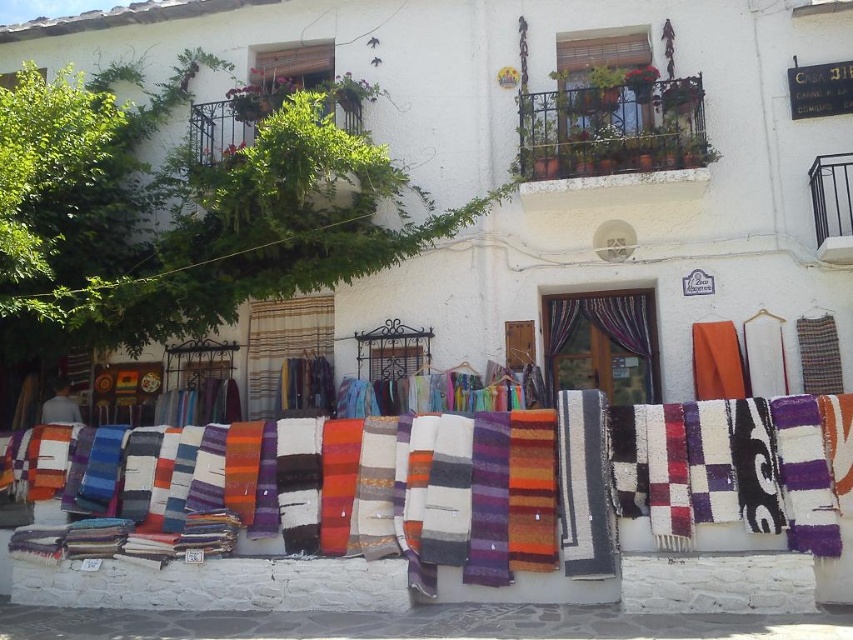
Question: Is multicolored woven curtain at center smaller than striped fabric at center?

Choices:
 (A) yes
 (B) no

Answer: (B)

Question: From the image, what is the correct spatial relationship of multicolored woven curtain at center in relation to striped fabric at center?

Choices:
 (A) below
 (B) above

Answer: (B)

Question: Which of the following is the closest to the observer?

Choices:
 (A) striped fabric at center
 (B) multicolored woven curtain at center

Answer: (B)

Question: Which of the following is the farthest from the observer?

Choices:
 (A) (309, 307)
 (B) (656, 372)

Answer: (A)

Question: Is multicolored woven curtain at center smaller than striped fabric at center?

Choices:
 (A) no
 (B) yes

Answer: (A)